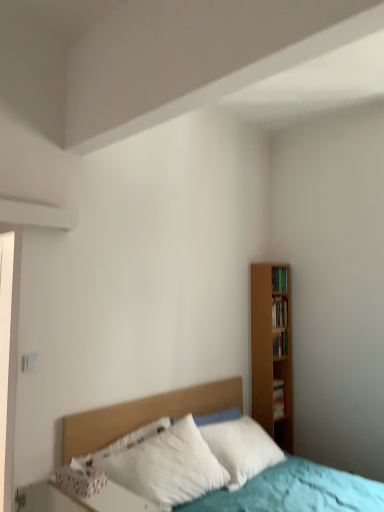
Question: Does wooden bookshelf at right, the 1th book when ordered from top to bottom, appear on the right side of hardcover book at right, the 4th book from the top?

Choices:
 (A) yes
 (B) no

Answer: (B)

Question: Can you confirm if wooden bookshelf at right, the 1th book when ordered from top to bottom, is bigger than hardcover book at right, the first book in the bottom-to-top sequence?

Choices:
 (A) yes
 (B) no

Answer: (A)

Question: Can you confirm if wooden bookshelf at right, which is the 4th book in bottom-to-top order, is shorter than hardcover book at right, the first book in the bottom-to-top sequence?

Choices:
 (A) yes
 (B) no

Answer: (B)

Question: Considering the relative positions of wooden bookshelf at right, which is the 4th book in bottom-to-top order, and hardcover book at right, the first book in the bottom-to-top sequence, in the image provided, is wooden bookshelf at right, which is the 4th book in bottom-to-top order, behind hardcover book at right, the first book in the bottom-to-top sequence,?

Choices:
 (A) yes
 (B) no

Answer: (B)

Question: Would you say wooden bookshelf at right, the 1th book when ordered from top to bottom, is outside hardcover book at right, the first book in the bottom-to-top sequence?

Choices:
 (A) no
 (B) yes

Answer: (B)

Question: From the image's perspective, is wooden bookshelf at right, marked as the second book in a top-to-bottom arrangement, located above or below wooden bookshelf at right, which is counted as the 3th book, starting from the top?

Choices:
 (A) above
 (B) below

Answer: (A)

Question: Choose the correct answer: Is wooden bookshelf at right, marked as the 3th book in a bottom-to-top arrangement, inside wooden bookshelf at right, which is counted as the 3th book, starting from the top, or outside it?

Choices:
 (A) inside
 (B) outside

Answer: (B)

Question: Considering the positions of wooden bookshelf at right, marked as the second book in a top-to-bottom arrangement, and wooden bookshelf at right, which is counted as the 3th book, starting from the top, in the image, is wooden bookshelf at right, marked as the second book in a top-to-bottom arrangement, taller or shorter than wooden bookshelf at right, which is counted as the 3th book, starting from the top,?

Choices:
 (A) tall
 (B) short

Answer: (A)

Question: From a real-world perspective, is wooden bookshelf at right, marked as the 3th book in a bottom-to-top arrangement, physically located above or below wooden bookshelf at right, placed as the second book when sorted from bottom to top?

Choices:
 (A) above
 (B) below

Answer: (A)

Question: Is wooden bookshelf at right, the 1th book when ordered from top to bottom, to the left or to the right of hardcover book at right, the first book in the bottom-to-top sequence, in the image?

Choices:
 (A) right
 (B) left

Answer: (B)

Question: Is wooden bookshelf at right, the 1th book when ordered from top to bottom, inside or outside of hardcover book at right, the first book in the bottom-to-top sequence?

Choices:
 (A) inside
 (B) outside

Answer: (B)

Question: In terms of height, does wooden bookshelf at right, the 1th book when ordered from top to bottom, look taller or shorter compared to hardcover book at right, the 4th book from the top?

Choices:
 (A) tall
 (B) short

Answer: (A)

Question: Based on their sizes in the image, would you say wooden bookshelf at right, the 1th book when ordered from top to bottom, is bigger or smaller than hardcover book at right, the first book in the bottom-to-top sequence?

Choices:
 (A) big
 (B) small

Answer: (A)

Question: Is wooden bookshelf at right, which is counted as the 3th book, starting from the top, taller or shorter than wooden headboard at center?

Choices:
 (A) tall
 (B) short

Answer: (B)

Question: Visually, is wooden bookshelf at right, which is counted as the 3th book, starting from the top, positioned to the left or to the right of wooden headboard at center?

Choices:
 (A) right
 (B) left

Answer: (A)